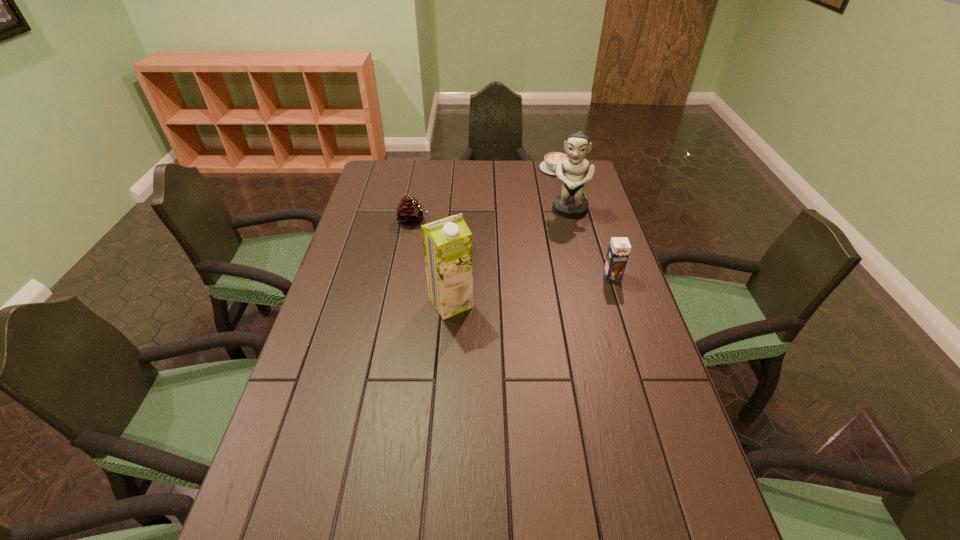
At what (x,y) coordinates should I click in order to perform the action: click on object that is at the far edge. Please return your answer as a coordinate pair (x, y). Image resolution: width=960 pixels, height=540 pixels. Looking at the image, I should click on (551, 159).

Where is `object that is at the left edge`? The height and width of the screenshot is (540, 960). object that is at the left edge is located at coordinates (410, 212).

This screenshot has width=960, height=540. I want to click on chocolate milk at the right edge, so click(619, 249).

Where is `figurine that is positioned at the right edge`? This screenshot has width=960, height=540. figurine that is positioned at the right edge is located at coordinates (571, 203).

At what (x,y) coordinates should I click in order to perform the action: click on cappuccino at the right edge. Please return your answer as a coordinate pair (x, y). This screenshot has height=540, width=960. Looking at the image, I should click on pos(551,159).

Locate an element on the screen. Image resolution: width=960 pixels, height=540 pixels. object at the far right corner is located at coordinates (551, 159).

Where is `blank space at the far edge of the desktop`? blank space at the far edge of the desktop is located at coordinates (512, 171).

Where is `vacant space at the near edge of the desktop`? vacant space at the near edge of the desktop is located at coordinates [422, 518].

I want to click on free region at the left edge, so click(351, 251).

Find the location of a particular element. The width and height of the screenshot is (960, 540). vacant area at the right edge of the desktop is located at coordinates (588, 191).